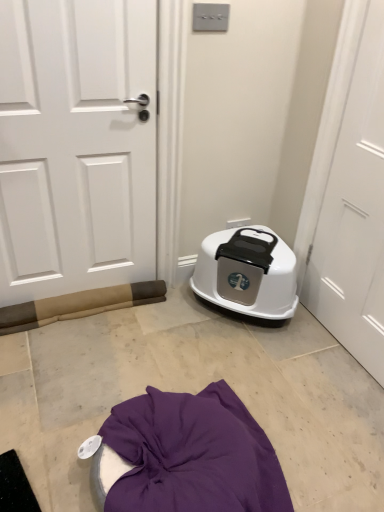
Question: Is white matte door at right, arranged as the second door when viewed from the left, not inside white matte door at left, acting as the second door starting from the right?

Choices:
 (A) no
 (B) yes

Answer: (B)

Question: Does white matte door at right, arranged as the second door when viewed from the left, turn towards white matte door at left, the first door positioned from the left?

Choices:
 (A) yes
 (B) no

Answer: (B)

Question: Is white matte door at right, arranged as the second door when viewed from the left, smaller than white matte door at left, the first door positioned from the left?

Choices:
 (A) yes
 (B) no

Answer: (A)

Question: Can you confirm if white matte door at right, arranged as the second door when viewed from the left, is positioned to the right of white matte door at left, the first door positioned from the left?

Choices:
 (A) yes
 (B) no

Answer: (A)

Question: Is white matte door at right, arranged as the second door when viewed from the left, wider than white matte door at left, acting as the second door starting from the right?

Choices:
 (A) no
 (B) yes

Answer: (A)

Question: Is white matte door at right, which is counted as the first door, starting from the right, turned away from white matte door at left, acting as the second door starting from the right?

Choices:
 (A) yes
 (B) no

Answer: (B)

Question: Is white matte door at right, which is counted as the first door, starting from the right, next to white plastic litter box at center?

Choices:
 (A) yes
 (B) no

Answer: (B)

Question: Considering the relative sizes of white matte door at right, arranged as the second door when viewed from the left, and white plastic litter box at center in the image provided, is white matte door at right, arranged as the second door when viewed from the left, smaller than white plastic litter box at center?

Choices:
 (A) no
 (B) yes

Answer: (B)

Question: Is white matte door at right, arranged as the second door when viewed from the left, turned away from white plastic litter box at center?

Choices:
 (A) no
 (B) yes

Answer: (A)

Question: Is white matte door at right, arranged as the second door when viewed from the left, bigger than white plastic litter box at center?

Choices:
 (A) no
 (B) yes

Answer: (A)

Question: Is white matte door at right, which is counted as the first door, starting from the right, not inside white plastic litter box at center?

Choices:
 (A) no
 (B) yes

Answer: (B)

Question: From a real-world perspective, is white matte door at right, which is counted as the first door, starting from the right, on top of white plastic litter box at center?

Choices:
 (A) yes
 (B) no

Answer: (A)

Question: Considering the relative sizes of white matte door at left, the first door positioned from the left, and white matte door at right, arranged as the second door when viewed from the left, in the image provided, is white matte door at left, the first door positioned from the left, thinner than white matte door at right, arranged as the second door when viewed from the left,?

Choices:
 (A) yes
 (B) no

Answer: (B)